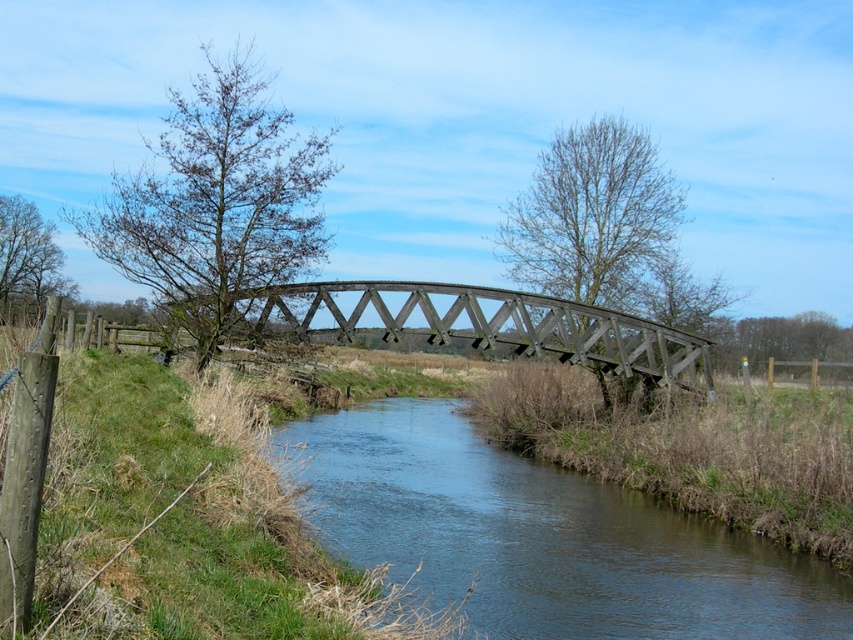
Which is below, dark brown water at center or dark brown wooden bridge at center?

dark brown water at center

Does dark brown water at center have a lesser height compared to dark brown wooden bridge at center?

Correct, dark brown water at center is not as tall as dark brown wooden bridge at center.

Find the location of `dark brown water at center`. dark brown water at center is located at coordinates (540, 536).

At what (x,y) coordinates should I click in order to perform the action: click on dark brown water at center. Please return your answer as a coordinate pair (x, y). Looking at the image, I should click on (540, 536).